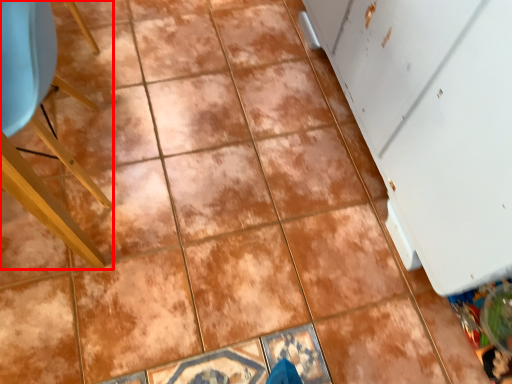
Question: From the image's perspective, where is furniture (annotated by the red box) located relative to screen door?

Choices:
 (A) below
 (B) above

Answer: (A)